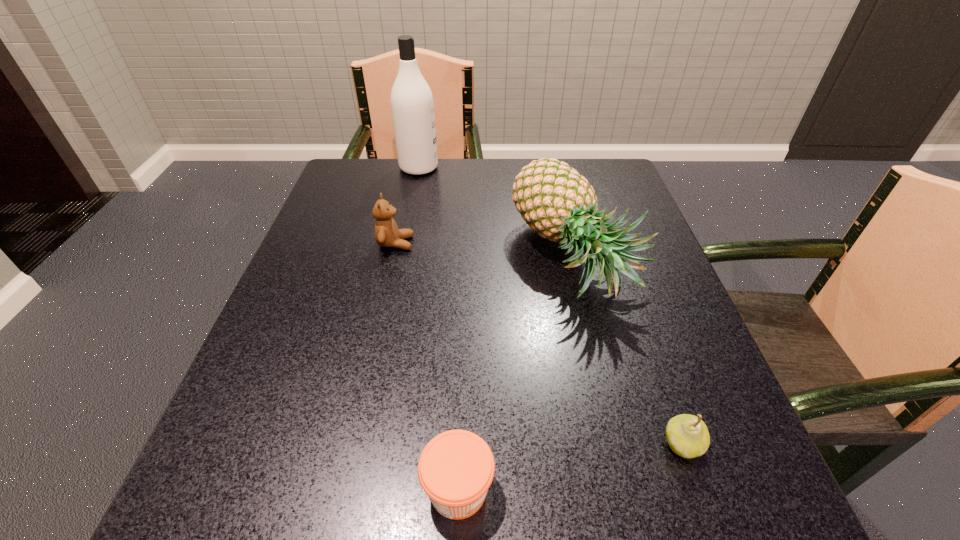
Find the location of a particular element. The image size is (960, 540). the tallest object is located at coordinates (412, 105).

At what (x,y) coordinates should I click in order to perform the action: click on the farthest object. Please return your answer as a coordinate pair (x, y). This screenshot has width=960, height=540. Looking at the image, I should click on (412, 105).

This screenshot has width=960, height=540. I want to click on pineapple, so click(x=557, y=202).

The image size is (960, 540). What are the coordinates of `teddy bear` in the screenshot? It's located at (387, 234).

You are a GUI agent. You are given a task and a screenshot of the screen. Output one action in this format:
    pyautogui.click(x=<x>, y=<y>)
    Task: Click on the pear
    The width and height of the screenshot is (960, 540).
    Given the screenshot: What is the action you would take?
    pyautogui.click(x=687, y=435)

Locate an element on the screen. the third object from right to left is located at coordinates (456, 468).

You are a GUI agent. You are given a task and a screenshot of the screen. Output one action in this format:
    pyautogui.click(x=<x>, y=<y>)
    Task: Click on the shortest object
    The image size is (960, 540).
    Given the screenshot: What is the action you would take?
    pyautogui.click(x=456, y=468)

This screenshot has height=540, width=960. Identify the location of free location located 0.120m on the front-facing side of the shampoo. (483, 167).

Identify the location of vacant space situated 0.240m on the back of the second tallest object. This screenshot has width=960, height=540. (551, 160).

At what (x,y) coordinates should I click in order to perform the action: click on free space located on the front-facing side of the third tallest object. Please return your answer as a coordinate pair (x, y). Looking at the image, I should click on pyautogui.click(x=459, y=243).